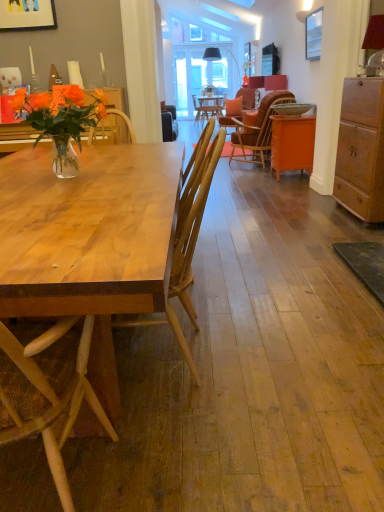
Locate an element on the screen. This screenshot has width=384, height=512. orange fabric chair at center, placed as the first chair when sorted from right to left is located at coordinates (258, 129).

Find the location of `wooden chair at center, arranged as the 2th chair when viewed from the top`. wooden chair at center, arranged as the 2th chair when viewed from the top is located at coordinates (192, 225).

Image resolution: width=384 pixels, height=512 pixels. Describe the element at coordinates (313, 34) in the screenshot. I see `metallic silver picture frame at upper right, marked as the first picture frame in a right-to-left arrangement` at that location.

What is the approximate width of matte white coffee cup at upper left?

matte white coffee cup at upper left is 4.25 inches in width.

The height and width of the screenshot is (512, 384). What do you see at coordinates (10, 79) in the screenshot? I see `matte white coffee cup at upper left` at bounding box center [10, 79].

What do you see at coordinates (27, 15) in the screenshot? The height and width of the screenshot is (512, 384). I see `wooden picture frame at upper left, positioned as the 1th picture frame in left-to-right order` at bounding box center [27, 15].

Locate an element on the screen. This screenshot has width=384, height=512. orange fabric chair at center, the second chair in the front-to-back sequence is located at coordinates (258, 129).

From the image's perspective, who appears lower, wooden chair at center, positioned as the second chair in back-to-front order, or matte white coffee cup at upper left?

wooden chair at center, positioned as the second chair in back-to-front order, from the image's perspective.

Identify the location of chair in front of the matte white coffee cup at upper left. The width and height of the screenshot is (384, 512). (192, 225).

Between wooden chair at center, the first chair when ordered from front to back, and matte white coffee cup at upper left, which one has larger width?

wooden chair at center, the first chair when ordered from front to back.

Between point (218, 143) and point (14, 82), which one is positioned behind?

The point (14, 82) is more distant.

Based on the photo, does natural wood desk at left, which is the second desk from back to front, have a lesser width compared to wooden cabinet at right, the 1th cabinetry when ordered from front to back?

Incorrect, the width of natural wood desk at left, which is the second desk from back to front, is not less than that of wooden cabinet at right, the 1th cabinetry when ordered from front to back.

From a real-world perspective, does natural wood desk at left, positioned as the 1th desk in front-to-back order, sit lower than wooden cabinet at right, which is counted as the second cabinetry, starting from the back?

Yes, from a real-world perspective, natural wood desk at left, positioned as the 1th desk in front-to-back order, is under wooden cabinet at right, which is counted as the second cabinetry, starting from the back.

Is natural wood desk at left, positioned as the first desk in bottom-to-top order, positioned beyond the bounds of wooden cabinet at right, which is counted as the second cabinetry, starting from the back?

Yes, natural wood desk at left, positioned as the first desk in bottom-to-top order, is outside of wooden cabinet at right, which is counted as the second cabinetry, starting from the back.

From the image's perspective, is natural wood desk at left, which is the second desk from back to front, located beneath wooden cabinet at right, the 1th cabinetry when ordered from front to back?

Correct, natural wood desk at left, which is the second desk from back to front, appears lower than wooden cabinet at right, the 1th cabinetry when ordered from front to back, in the image.

Who is smaller, wooden picture frame at upper left, positioned as the 1th picture frame in left-to-right order, or matte white coffee cup at upper left?

Smaller between the two is matte white coffee cup at upper left.

From the image's perspective, between wooden picture frame at upper left, marked as the 1th picture frame in a front-to-back arrangement, and matte white coffee cup at upper left, who is located below?

matte white coffee cup at upper left, from the image's perspective.

Is wooden picture frame at upper left, positioned as the 1th picture frame in left-to-right order, oriented away from matte white coffee cup at upper left?

No.

Is wooden cabinet at right, which is counted as the second cabinetry, starting from the back, in contact with wooden picture frame at upper left, which ranks as the second picture frame in back-to-front order?

They are not placed beside each other.

Does wooden cabinet at right, the 1th cabinetry when ordered from front to back, turn towards wooden picture frame at upper left, the second picture frame when ordered from right to left?

Yes, wooden cabinet at right, the 1th cabinetry when ordered from front to back, faces towards wooden picture frame at upper left, the second picture frame when ordered from right to left.

Is point (354, 139) closer to camera compared to point (19, 2)?

Yes, it is.

From a real-world perspective, which object stands above the other?

wooden picture frame at upper left, the second picture frame when ordered from right to left, from a real-world perspective.

Is wooden picture frame at upper left, positioned as the 1th picture frame in left-to-right order, positioned far away from metallic silver picture frame at upper right, the second picture frame when ordered from left to right?

wooden picture frame at upper left, positioned as the 1th picture frame in left-to-right order, is positioned a significant distance from metallic silver picture frame at upper right, the second picture frame when ordered from left to right.

Considering the positions of points (4, 11) and (317, 39), is point (4, 11) farther from camera compared to point (317, 39)?

No.

Who is smaller, wooden picture frame at upper left, which ranks as the second picture frame in back-to-front order, or metallic silver picture frame at upper right, marked as the first picture frame in a right-to-left arrangement?

With smaller size is wooden picture frame at upper left, which ranks as the second picture frame in back-to-front order.

How different are the orientations of wooden picture frame at upper left, positioned as the 1th picture frame in left-to-right order, and metallic silver picture frame at upper right, which ranks as the 2th picture frame in front-to-back order, in degrees?

The facing directions of wooden picture frame at upper left, positioned as the 1th picture frame in left-to-right order, and metallic silver picture frame at upper right, which ranks as the 2th picture frame in front-to-back order, are 89.3 degrees apart.

Based on their sizes in the image, would you say metallic silver picture frame at upper right, the second picture frame when ordered from left to right, is bigger or smaller than orange fabric chair at center, the second chair in the front-to-back sequence?

In the image, metallic silver picture frame at upper right, the second picture frame when ordered from left to right, appears to be smaller than orange fabric chair at center, the second chair in the front-to-back sequence.

In the scene shown: Which of these two, metallic silver picture frame at upper right, marked as the first picture frame in a right-to-left arrangement, or orange fabric chair at center, the 2th chair positioned from the bottom, stands shorter?

Standing shorter between the two is metallic silver picture frame at upper right, marked as the first picture frame in a right-to-left arrangement.

Which object is thinner, metallic silver picture frame at upper right, marked as the first picture frame in a right-to-left arrangement, or orange fabric chair at center, which is the second chair from left to right?

With smaller width is metallic silver picture frame at upper right, marked as the first picture frame in a right-to-left arrangement.

From a real-world perspective, which object rests below the other?

orange fabric chair at center, the second chair in the front-to-back sequence, from a real-world perspective.

Which point is more distant from viewer, (275, 102) or (2, 88)?

The point (275, 102) is farther from the camera.

Which object is positioned more to the right, orange fabric chair at center, the 2th chair positioned from the bottom, or matte white coffee cup at upper left?

From the viewer's perspective, orange fabric chair at center, the 2th chair positioned from the bottom, appears more on the right side.

Is orange fabric chair at center, the 1th chair when ordered from back to front, thinner than matte white coffee cup at upper left?

In fact, orange fabric chair at center, the 1th chair when ordered from back to front, might be wider than matte white coffee cup at upper left.

Find the location of `chair that is the 1st one when counting rightward from the matte white coffee cup at upper left`. chair that is the 1st one when counting rightward from the matte white coffee cup at upper left is located at coordinates (192, 225).

Locate an element on the screen. This screenshot has width=384, height=512. cabinetry that is above the natural wood desk at left, positioned as the first desk in bottom-to-top order (from a real-world perspective) is located at coordinates (361, 149).

Based on the photo, which object lies nearer to the anchor point wooden chair at center, positioned as the second chair in back-to-front order, wooden picture frame at upper left, the second picture frame when ordered from right to left, or orange fabric chair at center, the 1th chair when ordered from back to front?

Among the two, wooden picture frame at upper left, the second picture frame when ordered from right to left, is located nearer to wooden chair at center, positioned as the second chair in back-to-front order.

Consider the image. Estimate the real-world distances between objects in this image. Which object is further from natural wood desk at left, the 2th desk in the top-to-bottom sequence, orange matte cabinet at right, marked as the 1th cabinetry in a back-to-front arrangement, or clear glass vase at upper left, arranged as the 2th desk when viewed from the front?

Based on the image, orange matte cabinet at right, marked as the 1th cabinetry in a back-to-front arrangement, appears to be further to natural wood desk at left, the 2th desk in the top-to-bottom sequence.

Considering their positions, is metallic silver picture frame at upper right, which ranks as the 2th picture frame in front-to-back order, positioned further to wooden picture frame at upper left, the second picture frame when ordered from right to left, than wooden cabinet at right, which is counted as the second cabinetry, starting from the back?

Based on the image, wooden cabinet at right, which is counted as the second cabinetry, starting from the back, appears to be further to wooden picture frame at upper left, the second picture frame when ordered from right to left.

Which object lies further to the anchor point wooden picture frame at upper left, which ranks as the second picture frame in back-to-front order, orange matte cabinet at right, which is counted as the 2th cabinetry, starting from the front, or natural wood desk at left, which is the second desk from back to front?

natural wood desk at left, which is the second desk from back to front.

Which object lies nearer to the anchor point natural wood desk at left, positioned as the 1th desk in front-to-back order, wooden cabinet at right, the 1th cabinetry when ordered from front to back, or wooden chair at center, the first chair when ordered from front to back?

wooden chair at center, the first chair when ordered from front to back, is closer to natural wood desk at left, positioned as the 1th desk in front-to-back order.

When comparing their distances from metallic silver picture frame at upper right, the second picture frame when ordered from left to right, does wooden cabinet at right, the 1th cabinetry when ordered from front to back, or natural wood desk at left, positioned as the 1th desk in front-to-back order, seem further?

natural wood desk at left, positioned as the 1th desk in front-to-back order.

Looking at the image, which one is located closer to clear glass vase at upper left, acting as the first desk starting from the top, natural wood desk at left, the 2th desk in the top-to-bottom sequence, or orange matte cabinet at right, which is counted as the 2th cabinetry, starting from the front?

natural wood desk at left, the 2th desk in the top-to-bottom sequence, lies closer to clear glass vase at upper left, acting as the first desk starting from the top, than the other object.

Estimate the real-world distances between objects in this image. Which object is closer to wooden cabinet at right, the 1th cabinetry when ordered from front to back, clear glass vase at upper left, arranged as the 2th desk when viewed from the front, or natural wood desk at left, positioned as the 1th desk in front-to-back order?

Among the two, natural wood desk at left, positioned as the 1th desk in front-to-back order, is located nearer to wooden cabinet at right, the 1th cabinetry when ordered from front to back.

Where is `coffee cup between natural wood desk at left, the 2th desk in the top-to-bottom sequence, and orange fabric chair at center, the 2th chair positioned from the bottom, along the z-axis`? Image resolution: width=384 pixels, height=512 pixels. coffee cup between natural wood desk at left, the 2th desk in the top-to-bottom sequence, and orange fabric chair at center, the 2th chair positioned from the bottom, along the z-axis is located at coordinates (10, 79).

This screenshot has height=512, width=384. I want to click on coffee cup located between natural wood desk at left, positioned as the first desk in bottom-to-top order, and orange matte cabinet at right, which is counted as the 2th cabinetry, starting from the front, in the depth direction, so click(10, 79).

The width and height of the screenshot is (384, 512). I want to click on coffee cup between wooden chair at center, arranged as the 2th chair when viewed from the top, and orange fabric chair at center, which is the second chair from left to right, from front to back, so click(x=10, y=79).

The image size is (384, 512). In order to click on coffee cup between natural wood desk at left, the 2th desk in the top-to-bottom sequence, and metallic silver picture frame at upper right, which ranks as the 2th picture frame in front-to-back order, along the z-axis in this screenshot , I will do `click(10, 79)`.